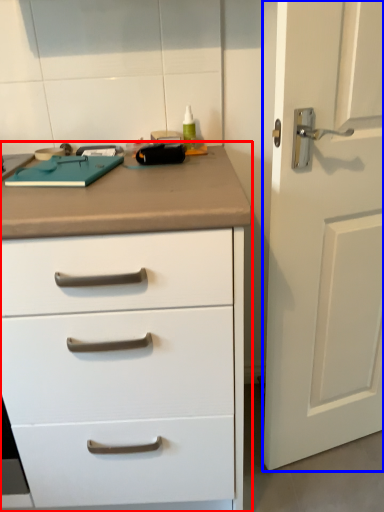
Question: Among these objects, which one is farthest to the camera, chest of drawers (highlighted by a red box) or door (highlighted by a blue box)?

Choices:
 (A) chest of drawers
 (B) door

Answer: (B)